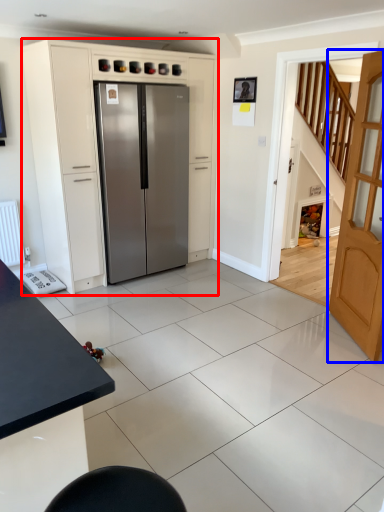
Question: Which point is closer to the camera, cabinetry (highlighted by a red box) or door (highlighted by a blue box)?

Choices:
 (A) cabinetry
 (B) door

Answer: (B)